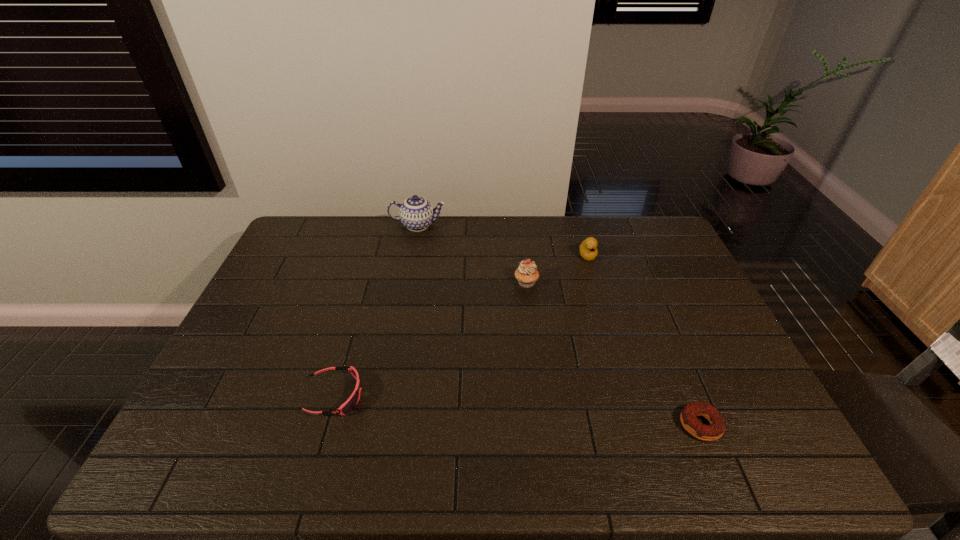
Locate an element on the screen. The image size is (960, 540). blank region between the cupcake and the chinaware is located at coordinates (472, 254).

Where is `vacant point located between the second shortest object and the third object from right to left`? This screenshot has width=960, height=540. vacant point located between the second shortest object and the third object from right to left is located at coordinates (430, 339).

Identify the location of vacant space in between the doughnut and the tallest object. (560, 325).

In order to click on free space between the second shortest object and the farthest object in this screenshot , I will do `click(376, 310)`.

Identify the location of object that is the nearest to the cupcake. (588, 251).

Select which object appears as the closest to the goggles. Please provide its 2D coordinates. Your answer should be formatted as a tuple, i.e. [(x, y)], where the tuple contains the x and y coordinates of a point satisfying the conditions above.

[(526, 274)]

Where is `free location that satisfies the following two spatial constraints: 1. on the face of the rightmost object; 2. on the right side of the second farthest object`? This screenshot has width=960, height=540. free location that satisfies the following two spatial constraints: 1. on the face of the rightmost object; 2. on the right side of the second farthest object is located at coordinates (637, 425).

Find the location of a particular element. The height and width of the screenshot is (540, 960). vacant space that satisfies the following two spatial constraints: 1. on the front-facing side of the second shortest object; 2. on the left side of the rightmost object is located at coordinates (325, 425).

Find the location of a particular element. This screenshot has height=540, width=960. vacant point that satisfies the following two spatial constraints: 1. on the front-facing side of the goggles; 2. on the right side of the doughnut is located at coordinates (325, 425).

The image size is (960, 540). I want to click on free spot that satisfies the following two spatial constraints: 1. at the spout of the shortest object; 2. on the left side of the tallest object, so click(x=381, y=425).